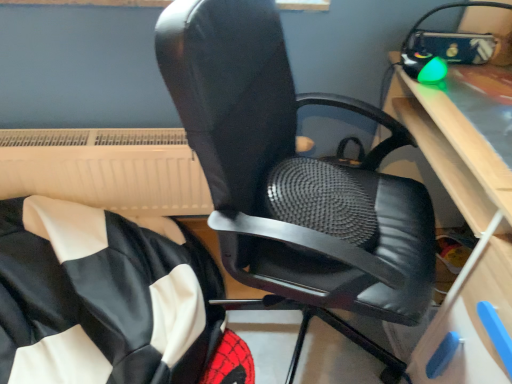
Question: Looking at their shapes, would you say white plastic radiator at upper left is wider or thinner than black leather chair at center?

Choices:
 (A) wide
 (B) thin

Answer: (B)

Question: Considering their positions, is white plastic radiator at upper left located in front of or behind black leather chair at center?

Choices:
 (A) behind
 (B) front

Answer: (A)

Question: Which object is positioned closest to the black leather chair at center?

Choices:
 (A) white plastic radiator at upper left
 (B) light wood computer desk at right

Answer: (B)

Question: Which object is positioned farthest from the black leather chair at center?

Choices:
 (A) white plastic radiator at upper left
 (B) light wood computer desk at right

Answer: (A)